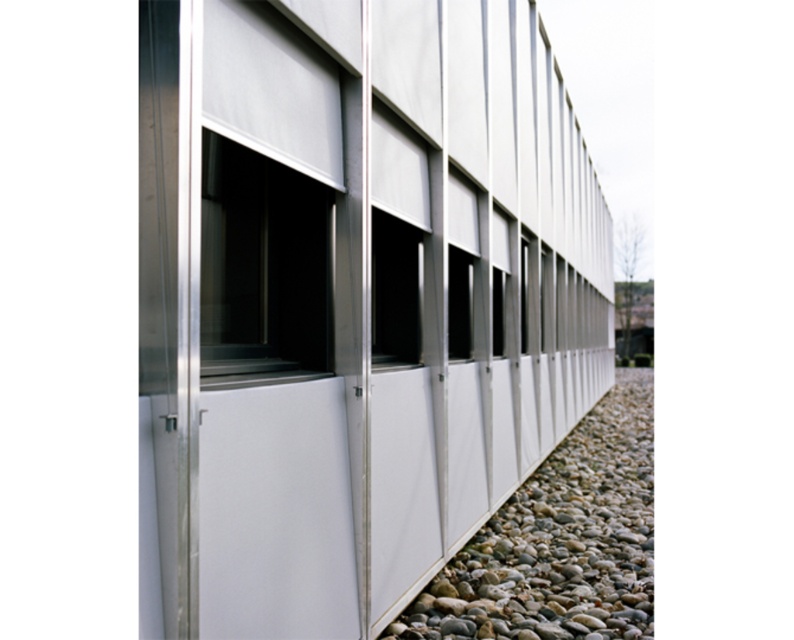
Question: Which point is farther from the camera taking this photo?

Choices:
 (A) (464, 259)
 (B) (241, 323)
 (C) (650, 458)
 (D) (388, 291)

Answer: (C)

Question: Does smooth pebble at lower right have a larger size compared to transparent glass window at center?

Choices:
 (A) yes
 (B) no

Answer: (A)

Question: From the image, what is the correct spatial relationship of smooth pebble at lower right in relation to transparent glass window at center?

Choices:
 (A) below
 (B) above

Answer: (A)

Question: Which is nearer to the matte glass window at center?

Choices:
 (A) transparent glass window at center
 (B) smooth pebble at lower right

Answer: (A)

Question: Which point is farther to the camera?

Choices:
 (A) matte silver window at center
 (B) matte glass window at center
 (C) transparent glass window at center
 (D) smooth pebble at lower right

Answer: (C)

Question: In this image, where is smooth pebble at lower right located relative to matte glass window at center?

Choices:
 (A) below
 (B) above

Answer: (A)